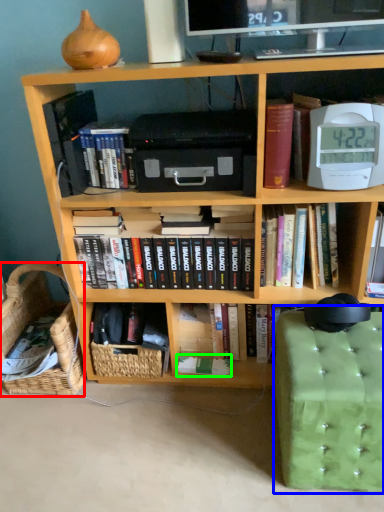
Question: Which object is the closest to the basket (highlighted by a red box)? Choose among these: swivel chair (highlighted by a blue box) or paperback book (highlighted by a green box).

Choices:
 (A) swivel chair
 (B) paperback book

Answer: (B)